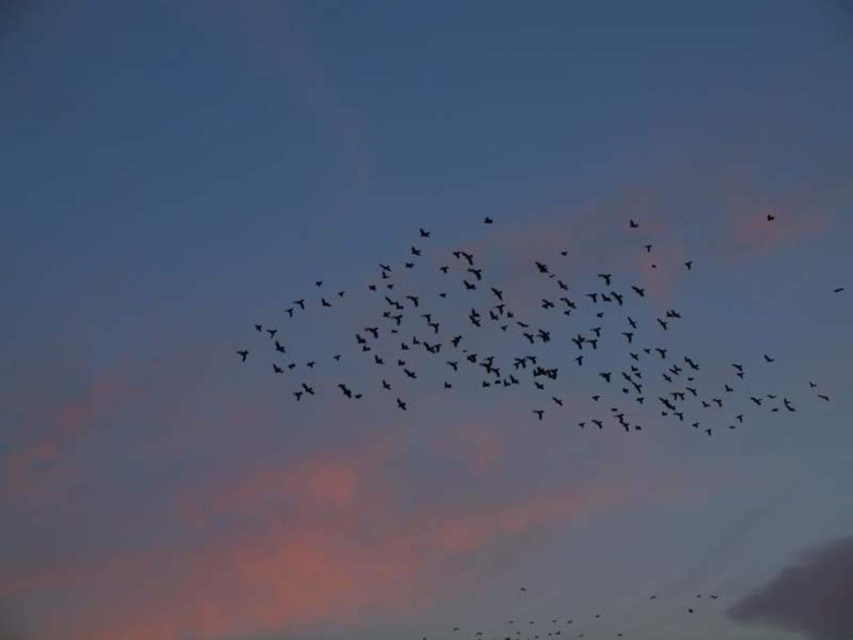
Does point (479, 330) come closer to viewer compared to point (842, 577)?

Yes.

Locate an element on the screen. This screenshot has width=853, height=640. black matte birds at center is located at coordinates (511, 346).

Who is more forward, (757, 400) or (769, 214)?

Point (757, 400)

Which is behind, point (627, 312) or point (772, 220)?

The point (772, 220) is behind.

I want to click on black matte birds at center, so tap(511, 346).

Which is above, gray matte cloud at lower right or black matte bird at upper right?

Positioned higher is black matte bird at upper right.

Who is more distant from viewer, (843,586) or (770,212)?

Point (843,586)

You are a GUI agent. You are given a task and a screenshot of the screen. Output one action in this format:
    pyautogui.click(x=<x>, y=<y>)
    Task: Click on the gray matte cloud at lower right
    The width and height of the screenshot is (853, 640).
    Given the screenshot: What is the action you would take?
    pyautogui.click(x=805, y=595)